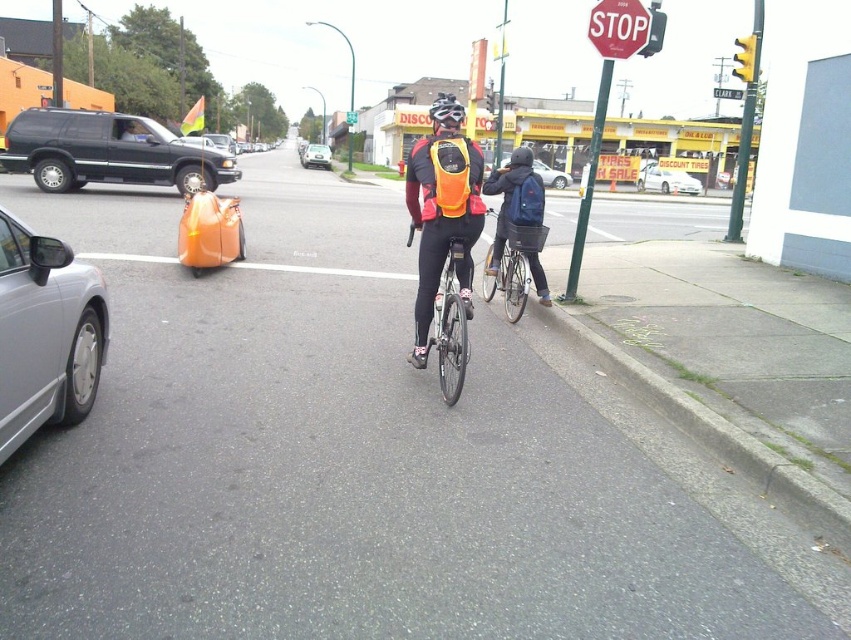
Is dark blue backpack at center thinner than white glossy sedan at center?

Yes.

Can you confirm if dark blue backpack at center is shorter than white glossy sedan at center?

Yes.

Which is in front, point (521, 212) or point (654, 170)?

Positioned in front is point (521, 212).

Find the location of a particular element. dark blue backpack at center is located at coordinates (513, 200).

Between matte orange safety vest at center and black matte bicycle helmet at center, which one appears on the right side from the viewer's perspective?

Positioned to the right is matte orange safety vest at center.

Does matte orange safety vest at center have a lesser height compared to black matte bicycle helmet at center?

Yes, matte orange safety vest at center is shorter than black matte bicycle helmet at center.

Does point (529, 216) come in front of point (443, 100)?

No.

I want to click on matte orange safety vest at center, so click(524, 200).

Is dark blue backpack at center closer to camera compared to metallic silver car at center?

That is True.

I want to click on dark blue backpack at center, so click(x=513, y=200).

Image resolution: width=851 pixels, height=640 pixels. I want to click on dark blue backpack at center, so click(513, 200).